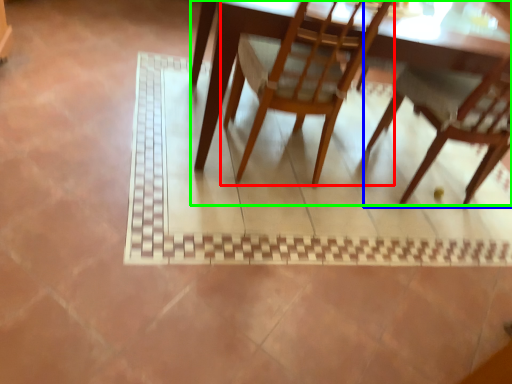
Question: Which object is the farthest from chair (highlighted by a red box)? Choose among these: chair (highlighted by a blue box) or table (highlighted by a green box).

Choices:
 (A) chair
 (B) table

Answer: (A)